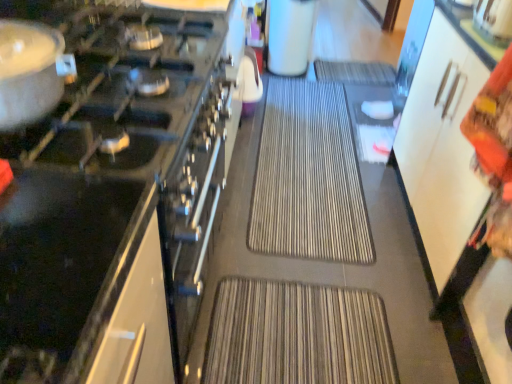
Question: From their relative heights in the image, would you say brown textured mat at center is taller or shorter than white matte coffee maker at upper center, acting as the first appliance starting from the back?

Choices:
 (A) tall
 (B) short

Answer: (B)

Question: Choose the correct answer: Is brown textured mat at center inside white matte coffee maker at upper center, acting as the first appliance starting from the back, or outside it?

Choices:
 (A) inside
 (B) outside

Answer: (B)

Question: Which object is the closest to the black glass cooktop at left, the 3th appliance in the back-to-front sequence?

Choices:
 (A) metallic silver kettle at upper right, the 2th appliance positioned from the bottom
 (B) white matte coffee maker at upper center, which is the first appliance from top to bottom
 (C) matte silver pot at left
 (D) brown textured mat at center

Answer: (C)

Question: Considering the real-world distances, which object is closest to the metallic silver kettle at upper right, the first appliance positioned from the right?

Choices:
 (A) brown textured mat at center
 (B) matte silver pot at left
 (C) black glass cooktop at left, the 1th appliance viewed from the left
 (D) white matte coffee maker at upper center, the third appliance in the front-to-back sequence

Answer: (C)